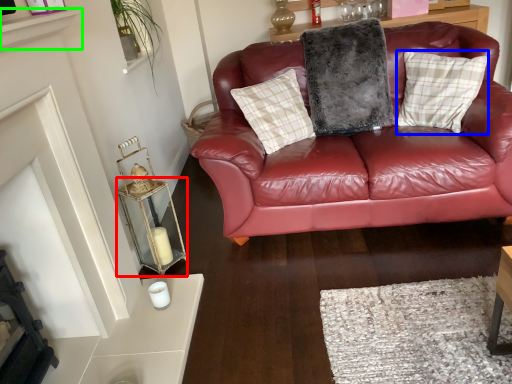
Question: Which is nearer to the table (highlighted by a red box)? pillow (highlighted by a blue box) or shelf (highlighted by a green box).

Choices:
 (A) pillow
 (B) shelf

Answer: (B)